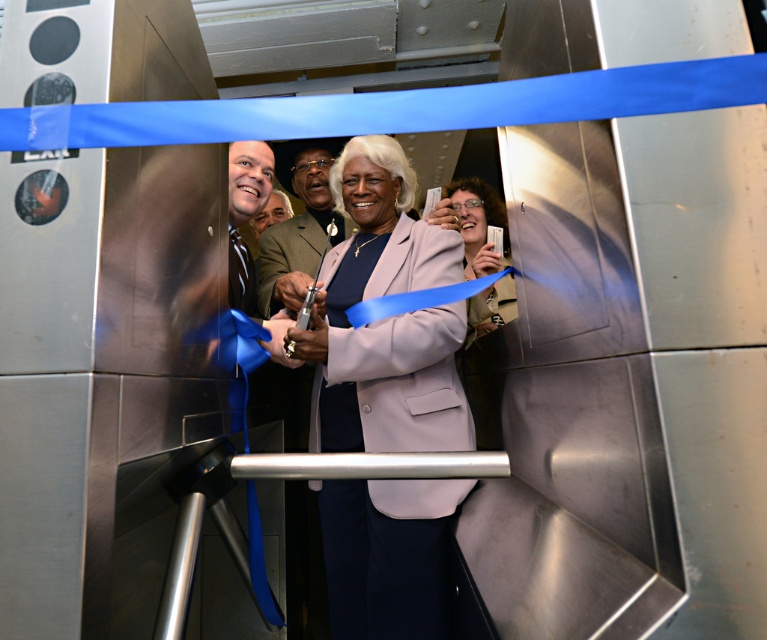
You are standing at the origin point in the image. The light brown leather jacket at center is located at point (x=298, y=224). Which direction should you move to reach the light brown leather jacket at center?

The light brown leather jacket at center is located at point (x=298, y=224), so you should move towards the coordinates provided to reach it.

You are attending a ribbon cutting ceremony and notice two attendees wearing jackets. One is wearing a matte pink blazer at center and another is wearing a light brown leather jacket at center. Which jacket is positioned lower on the person?

The matte pink blazer at center is positioned lower than the light brown leather jacket at center.

You are attending the ribbon cutting ceremony and need to decide which jacket to wear. The light brown leather jacket at center and the matte purple jacket at center are both available. Which jacket has a larger size?

The light brown leather jacket at center is bigger than the matte purple jacket at center, so the light brown leather jacket at center has a larger size.